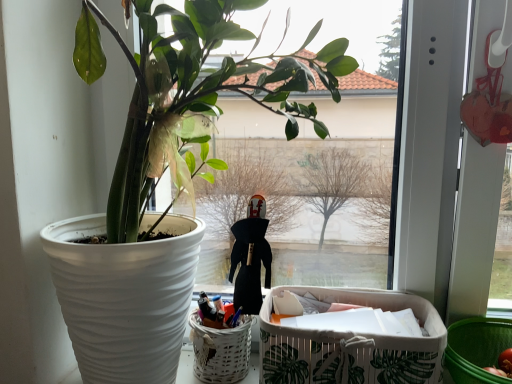
Question: Is green leaf-patterned fabric basket at lower right thinner than green plastic basket at lower right?

Choices:
 (A) no
 (B) yes

Answer: (B)

Question: Does green leaf-patterned fabric basket at lower right have a larger size compared to green plastic basket at lower right?

Choices:
 (A) yes
 (B) no

Answer: (A)

Question: Does green leaf-patterned fabric basket at lower right come in front of green plastic basket at lower right?

Choices:
 (A) no
 (B) yes

Answer: (A)

Question: Does green leaf-patterned fabric basket at lower right appear on the left side of green plastic basket at lower right?

Choices:
 (A) no
 (B) yes

Answer: (B)

Question: Is green leaf-patterned fabric basket at lower right wider than green plastic basket at lower right?

Choices:
 (A) no
 (B) yes

Answer: (A)

Question: From the image's perspective, is white wicker basket at lower center above or below green plastic basket at lower right?

Choices:
 (A) below
 (B) above

Answer: (B)

Question: Is white wicker basket at lower center taller or shorter than green plastic basket at lower right?

Choices:
 (A) tall
 (B) short

Answer: (A)

Question: In terms of size, does white wicker basket at lower center appear bigger or smaller than green plastic basket at lower right?

Choices:
 (A) big
 (B) small

Answer: (B)

Question: In the image, is white wicker basket at lower center positioned in front of or behind green plastic basket at lower right?

Choices:
 (A) front
 (B) behind

Answer: (B)

Question: Is point (349, 337) positioned closer to the camera than point (484, 354)?

Choices:
 (A) farther
 (B) closer

Answer: (B)

Question: From the image's perspective, is green leaf-patterned fabric basket at lower right positioned above or below green plastic basket at lower right?

Choices:
 (A) above
 (B) below

Answer: (A)

Question: Based on their positions, is green leaf-patterned fabric basket at lower right located to the left or right of green plastic basket at lower right?

Choices:
 (A) left
 (B) right

Answer: (A)

Question: From a real-world perspective, is green leaf-patterned fabric basket at lower right above or below green plastic basket at lower right?

Choices:
 (A) above
 (B) below

Answer: (A)

Question: From a real-world perspective, is white wicker basket at lower center above or below green leaf-patterned fabric basket at lower right?

Choices:
 (A) below
 (B) above

Answer: (A)

Question: In terms of size, does white wicker basket at lower center appear bigger or smaller than green leaf-patterned fabric basket at lower right?

Choices:
 (A) small
 (B) big

Answer: (A)